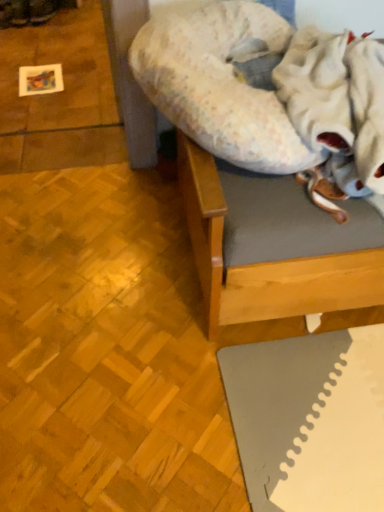
Question: Does fluffy white blanket at upper right lie in front of wooden bed frame at upper right?

Choices:
 (A) no
 (B) yes

Answer: (B)

Question: Is fluffy white blanket at upper right located outside wooden bed frame at upper right?

Choices:
 (A) no
 (B) yes

Answer: (A)

Question: From a real-world perspective, is fluffy white blanket at upper right over wooden bed frame at upper right?

Choices:
 (A) yes
 (B) no

Answer: (A)

Question: Does fluffy white blanket at upper right have a greater height compared to wooden bed frame at upper right?

Choices:
 (A) no
 (B) yes

Answer: (A)

Question: Is fluffy white blanket at upper right to the right of wooden bed frame at upper right from the viewer's perspective?

Choices:
 (A) no
 (B) yes

Answer: (A)

Question: Can wooden bed frame at upper right be found inside fluffy white blanket at upper right?

Choices:
 (A) yes
 (B) no

Answer: (B)

Question: Can you confirm if fluffy fabric dog bed at upper center is positioned to the right of fluffy white blanket at upper right?

Choices:
 (A) yes
 (B) no

Answer: (B)

Question: Is the depth of fluffy fabric dog bed at upper center greater than that of fluffy white blanket at upper right?

Choices:
 (A) no
 (B) yes

Answer: (B)

Question: Does fluffy fabric dog bed at upper center have a lesser width compared to fluffy white blanket at upper right?

Choices:
 (A) yes
 (B) no

Answer: (B)

Question: Does fluffy fabric dog bed at upper center have a larger size compared to fluffy white blanket at upper right?

Choices:
 (A) no
 (B) yes

Answer: (B)

Question: Could fluffy white blanket at upper right be considered to be inside fluffy fabric dog bed at upper center?

Choices:
 (A) no
 (B) yes

Answer: (A)

Question: Is fluffy fabric dog bed at upper center aimed at fluffy white blanket at upper right?

Choices:
 (A) no
 (B) yes

Answer: (A)

Question: From the image's perspective, is wooden bed frame at upper right below fluffy white blanket at upper right?

Choices:
 (A) yes
 (B) no

Answer: (A)